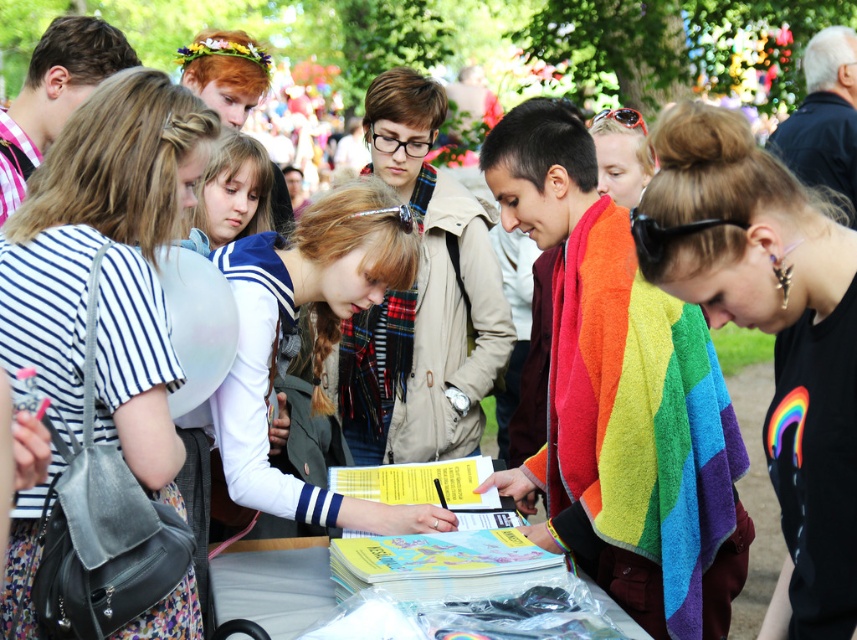
Looking at this image, you are a participant at this event and need to place a heavy object on the surface of the white plastic table at center. However, there is a rainbow fabric towel at center currently on it. What should you do to ensure the object can be placed securely?

The rainbow fabric towel at center is above the white plastic table at center, so you should remove the rainbow fabric towel at center from the white plastic table at center to create a clear, stable surface for placing the heavy object securely.

You are organizing a community event and need to place a large banner on the table. The banner is 1.2 meters wide. Can the white plastic table at center support the rainbow fabric towel at center and the banner without overcrowding?

The rainbow fabric towel at center might be wider than the white plastic table at center, so placing a 1.2 meter wide banner along with it could overcrowd the table. Check the table dimensions before deciding.